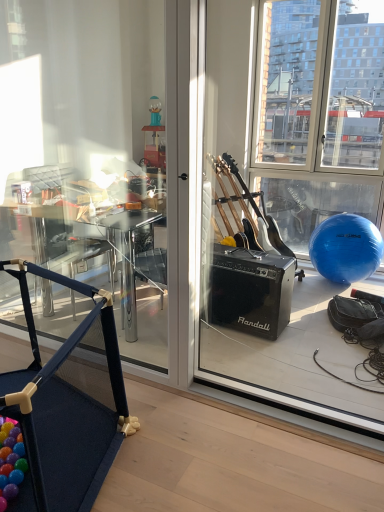
Question: In terms of height, does blue fabric playpen at lower left look taller or shorter compared to transparent glass window screen at right?

Choices:
 (A) tall
 (B) short

Answer: (B)

Question: Does point (69, 438) appear closer or farther from the camera than point (294, 188)?

Choices:
 (A) closer
 (B) farther

Answer: (A)

Question: Estimate the real-world distances between objects in this image. Which object is closer to the blue fabric playpen at lower left?

Choices:
 (A) wooden floor at lower left
 (B) transparent glass window screen at right

Answer: (A)

Question: Which is nearer to the transparent glass window screen at right?

Choices:
 (A) blue fabric playpen at lower left
 (B) wooden floor at lower left

Answer: (B)